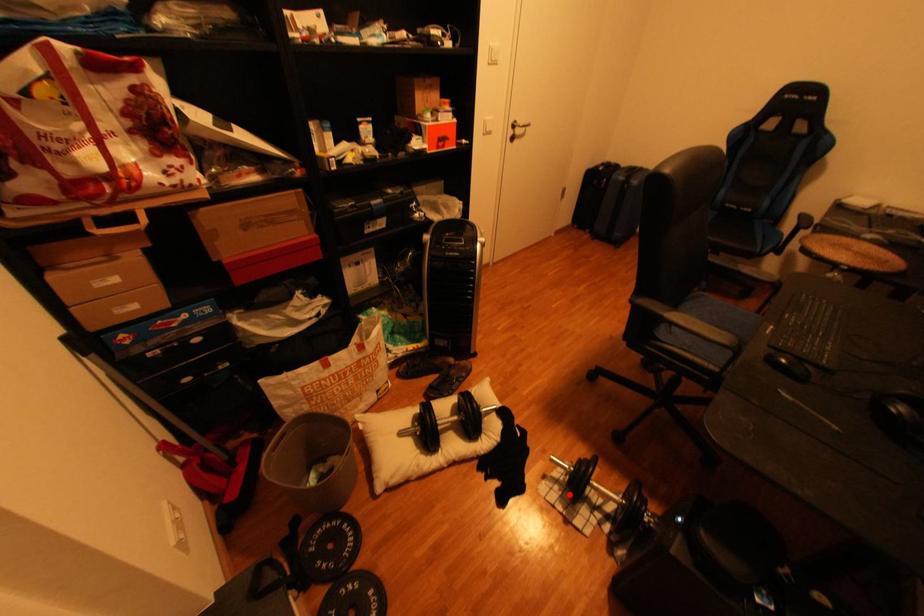
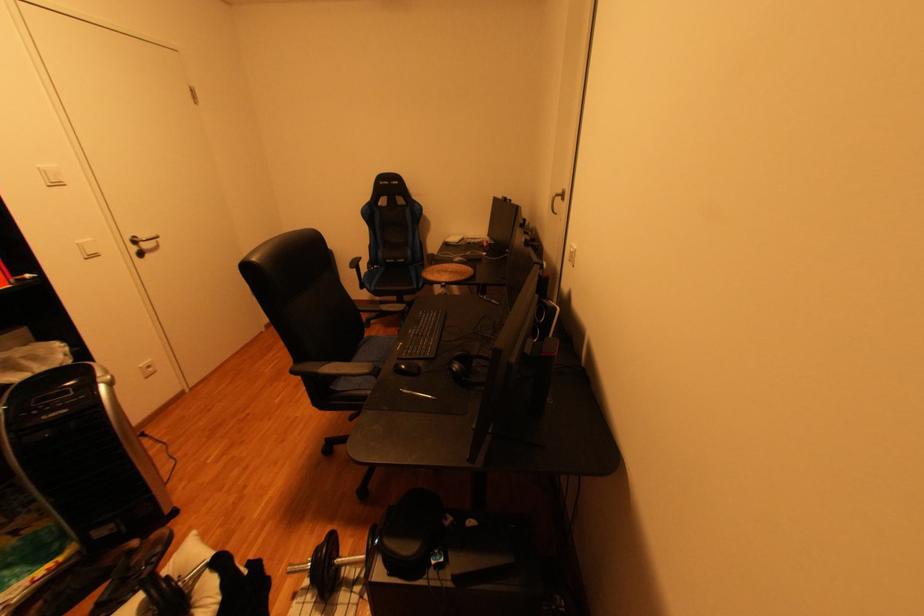
Question: I am providing you with two images of the same scene from different viewpoints. Image1 has a red point marked. In image2, the corresponding 3D location appears at what relative position? Reply with the corresponding letter.

Choices:
 (A) Closer
 (B) Farther

Answer: (B)